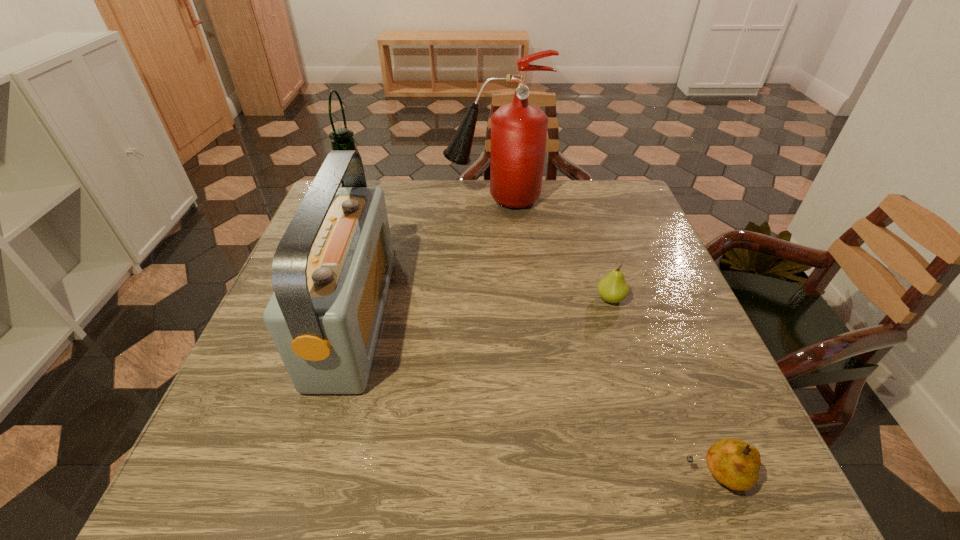
The width and height of the screenshot is (960, 540). Identify the location of the tallest object. (519, 129).

In order to click on the third object from left to right in this screenshot , I will do `click(519, 129)`.

Locate an element on the screen. The width and height of the screenshot is (960, 540). lantern is located at coordinates (341, 138).

Where is `radio receiver`? This screenshot has height=540, width=960. radio receiver is located at coordinates (331, 271).

At what (x,y) coordinates should I click in order to perform the action: click on the farther pear. Please return your answer as a coordinate pair (x, y). Looking at the image, I should click on (613, 288).

Where is `the nearest object`? This screenshot has width=960, height=540. the nearest object is located at coordinates (734, 463).

I want to click on free space located with the nozzle aimed from the third object from right to left, so click(x=393, y=199).

This screenshot has height=540, width=960. In order to click on vacant area situated with the nozzle aimed from the third object from right to left in this screenshot , I will do `click(413, 199)`.

Find the location of a particular element. The height and width of the screenshot is (540, 960). vacant area located with the nozzle aimed from the third object from right to left is located at coordinates (380, 199).

This screenshot has height=540, width=960. In order to click on free space located on the side where the lantern emits light in this screenshot , I will do `click(483, 200)`.